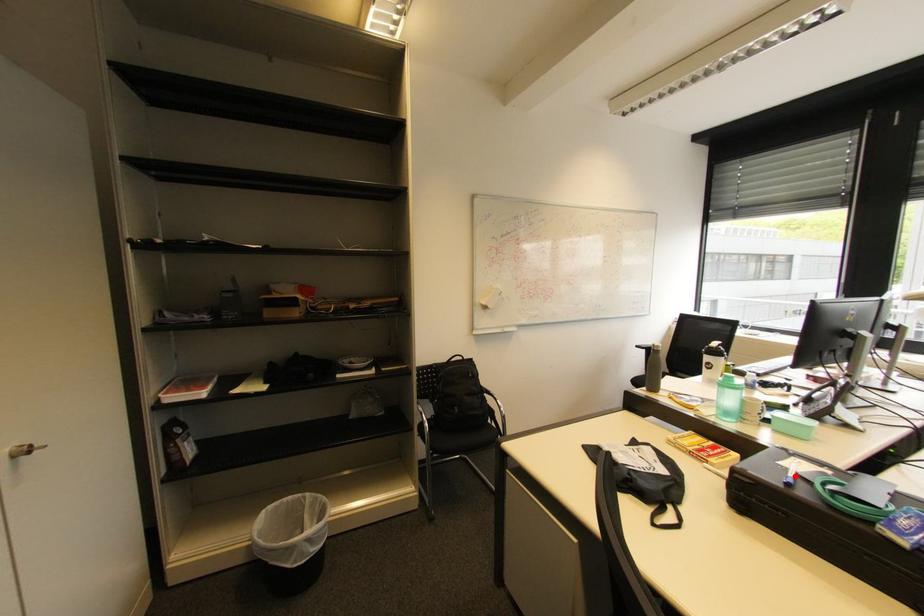
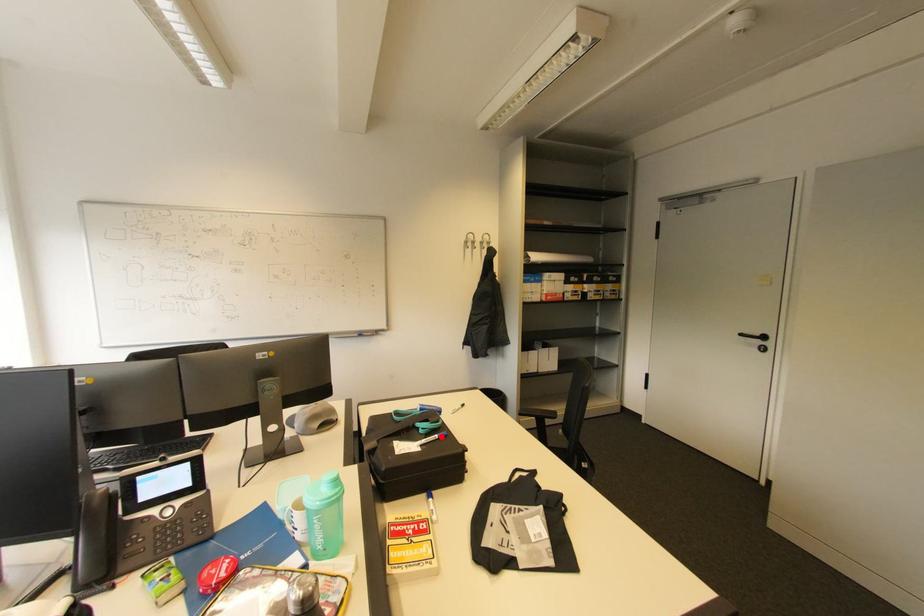
I am providing you with two images of the same scene from different viewpoints. A red point is marked on the first image and another point is marked on the second image. Is the red point in image1 aligned with the point shown in image2?

Yes